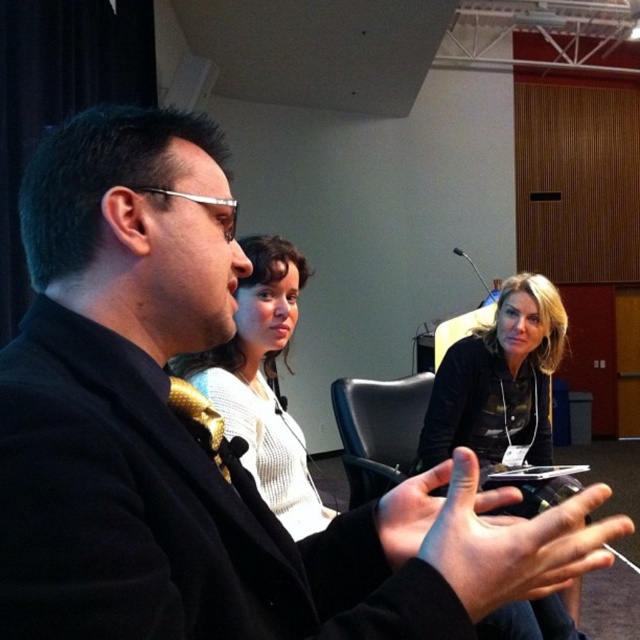
Question: Which is nearer to the black leather chair at center?

Choices:
 (A) white knit sweater at center
 (B) black fabric shirt at center

Answer: (B)

Question: Does white knit sweater at center have a greater width compared to black leather chair at center?

Choices:
 (A) yes
 (B) no

Answer: (B)

Question: Which point appears farthest from the camera in this image?

Choices:
 (A) (291, 296)
 (B) (541, 291)

Answer: (B)

Question: Based on their relative distances, which object is farther from the black fabric shirt at center?

Choices:
 (A) black leather chair at center
 (B) white knit sweater at center

Answer: (B)

Question: Does black fabric shirt at center have a greater width compared to white knit sweater at center?

Choices:
 (A) yes
 (B) no

Answer: (A)

Question: Does black fabric shirt at center appear on the left side of white knit sweater at center?

Choices:
 (A) no
 (B) yes

Answer: (A)